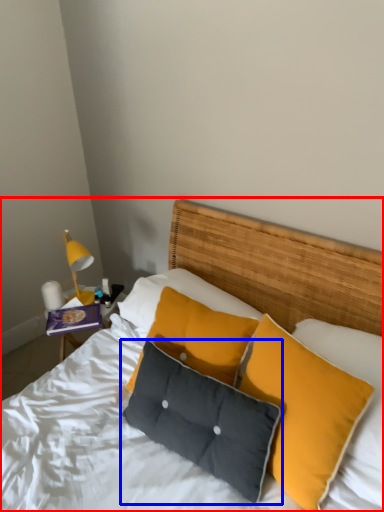
Question: Which object is further to the camera taking this photo, bed (highlighted by a red box) or pillow (highlighted by a blue box)?

Choices:
 (A) bed
 (B) pillow

Answer: (A)